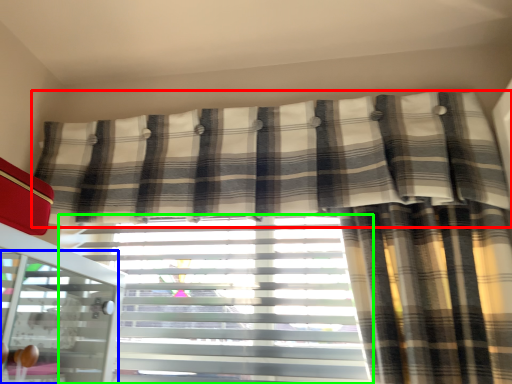
Question: Estimate the real-world distances between objects in this image. Which object is farther from curtain (highlighted by a red box), screen door (highlighted by a blue box) or window blind (highlighted by a green box)?

Choices:
 (A) screen door
 (B) window blind

Answer: (A)